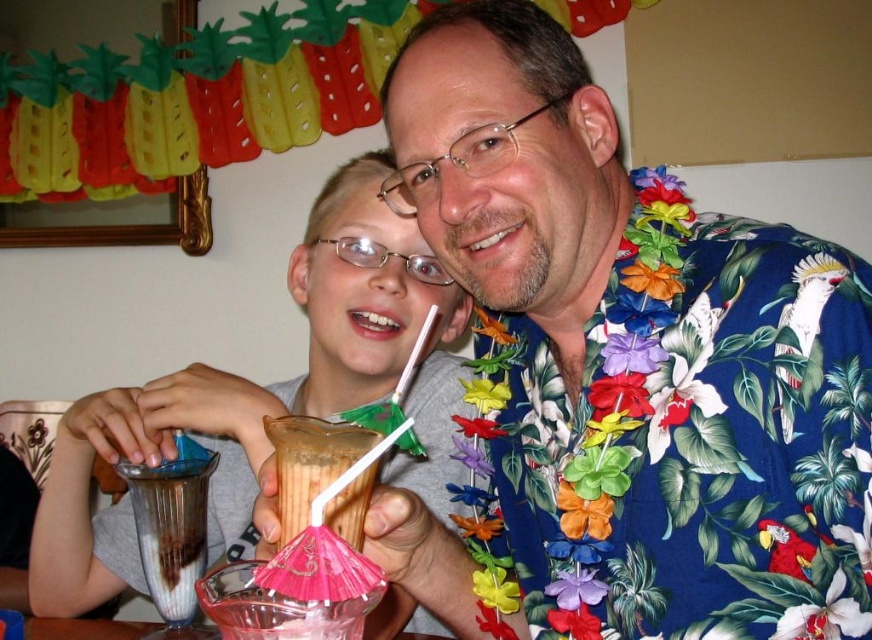
You are a photographer standing at a certain distance from the scene. You want to take a closeup shot of the blue floral shirt at center. Given that the camera requires a minimum distance of 20 inches for optimal focus, will you need to move closer or farther away?

The blue floral shirt at center is currently 19.23 inches away from the camera, which is less than the required 20 inches for optimal focus. Therefore, you should move farther away to increase the distance.

You are at the center of the image and want to grab the smooth plastic cup at center. Which direction should you move to reach it?

The smooth plastic cup at center is already at the center of the image, so you don not need to move in any direction to reach it.